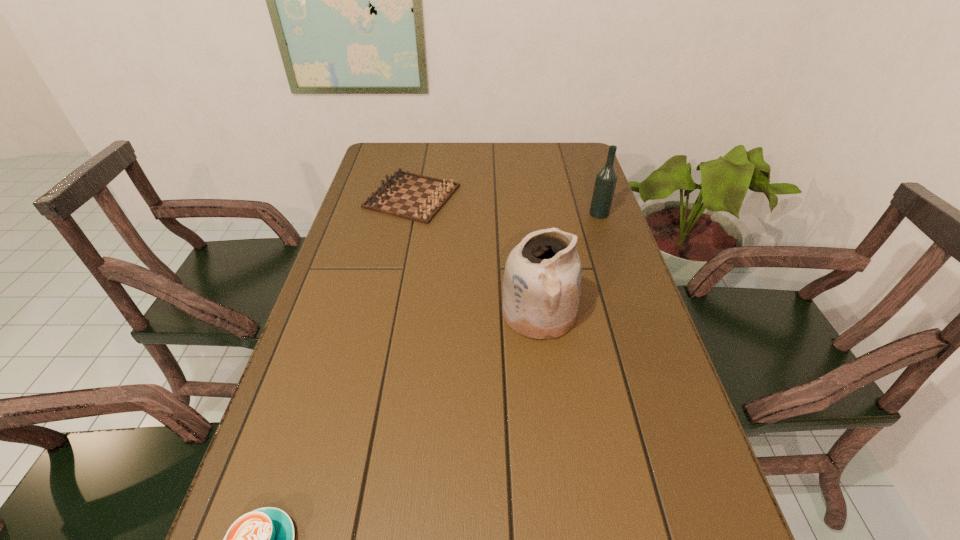
The image size is (960, 540). Find the location of `the second nearest object`. the second nearest object is located at coordinates (542, 280).

You are a GUI agent. You are given a task and a screenshot of the screen. Output one action in this format:
    pyautogui.click(x=<x>, y=<y>)
    Task: Click on the pottery
    This screenshot has width=960, height=540.
    Given the screenshot: What is the action you would take?
    pyautogui.click(x=542, y=280)

Where is `vodka`? vodka is located at coordinates (605, 183).

You are a GUI agent. You are given a task and a screenshot of the screen. Output one action in this format:
    pyautogui.click(x=<x>, y=<y>)
    Task: Click on the chessboard
    This screenshot has width=960, height=540.
    Given the screenshot: What is the action you would take?
    pyautogui.click(x=415, y=197)

The image size is (960, 540). Find the location of `vacant space located 0.170m on the back of the pottery`. vacant space located 0.170m on the back of the pottery is located at coordinates (530, 245).

Locate an element on the screen. The image size is (960, 540). vacant space situated 0.050m on the back of the vodka is located at coordinates (594, 199).

Find the location of a particular element. The image size is (960, 540). vacant space situated on the front of the chessboard is located at coordinates (402, 243).

The height and width of the screenshot is (540, 960). Find the location of `object present at the far edge`. object present at the far edge is located at coordinates (415, 197).

Find the location of a particular element. object that is at the left edge is located at coordinates (415, 197).

You are a GUI agent. You are given a task and a screenshot of the screen. Output one action in this format:
    pyautogui.click(x=<x>, y=<y>)
    Task: Click on the object that is at the right edge
    
    Given the screenshot: What is the action you would take?
    coord(605,183)